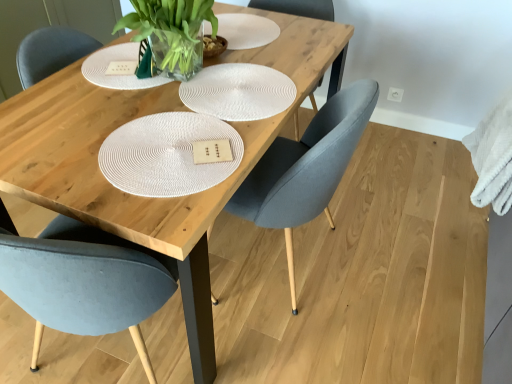
Where is `free space that is in between matte gray chair at center, which is counted as the 1th chair, starting from the right, and wooden table at center`? The width and height of the screenshot is (512, 384). free space that is in between matte gray chair at center, which is counted as the 1th chair, starting from the right, and wooden table at center is located at coordinates (291, 327).